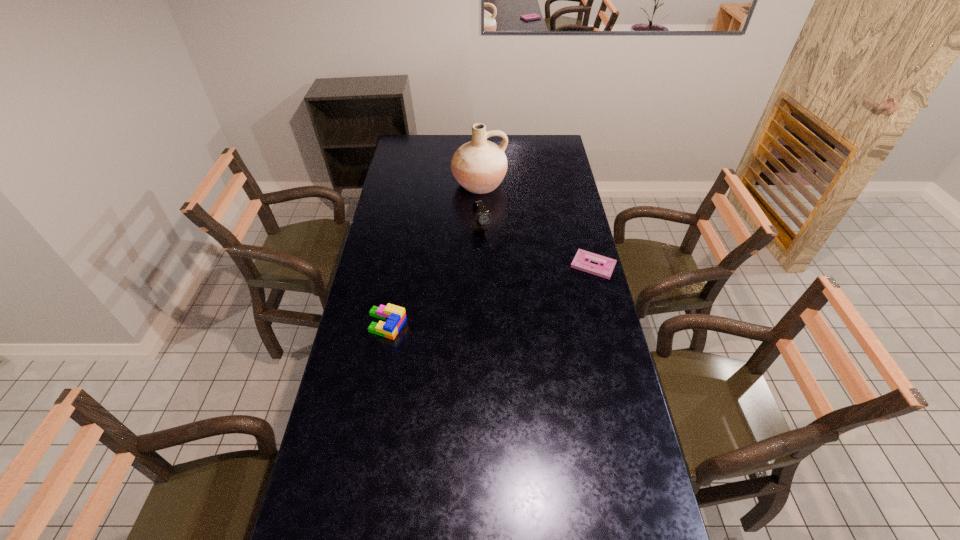
Where is `vacant space at the far left corner of the desktop`? The width and height of the screenshot is (960, 540). vacant space at the far left corner of the desktop is located at coordinates (399, 156).

Image resolution: width=960 pixels, height=540 pixels. I want to click on vacant space in between the second farthest object and the shortest object, so click(x=538, y=247).

Find the location of a particular element. The image size is (960, 540). free spot between the rightmost object and the third nearest object is located at coordinates click(538, 247).

Locate an element on the screen. vacant area between the shortest object and the nearest object is located at coordinates (491, 295).

Find the location of a particular element. The width and height of the screenshot is (960, 540). vacant point located between the leftmost object and the third nearest object is located at coordinates (435, 276).

Locate an element on the screen. vacant space in between the second tallest object and the Lego is located at coordinates (435, 276).

You are a GUI agent. You are given a task and a screenshot of the screen. Output one action in this format:
    pyautogui.click(x=<x>, y=<y>)
    Task: Click on the free space between the nearest object and the tallest object
    The width and height of the screenshot is (960, 540).
    Given the screenshot: What is the action you would take?
    pyautogui.click(x=433, y=254)

Where is `vacant space that is in between the farthest object and the rightmost object`? The width and height of the screenshot is (960, 540). vacant space that is in between the farthest object and the rightmost object is located at coordinates (537, 225).

Locate an element on the screen. free spot between the nearest object and the rightmost object is located at coordinates (491, 295).

Where is `free spot between the pottery and the videotape`? free spot between the pottery and the videotape is located at coordinates (537, 225).